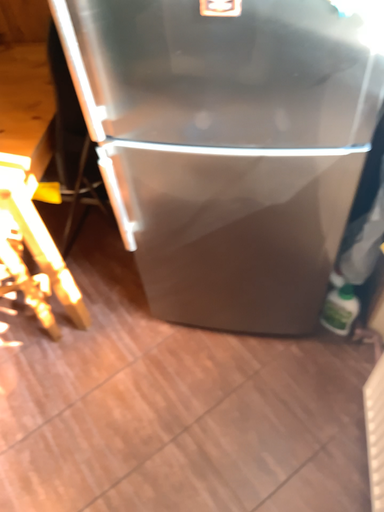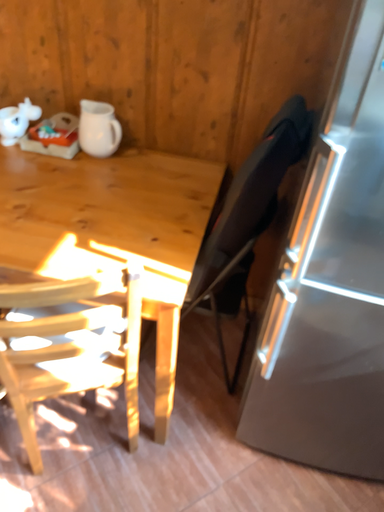
Question: Which way did the camera rotate in the video?

Choices:
 (A) rotated upward
 (B) rotated downward

Answer: (A)